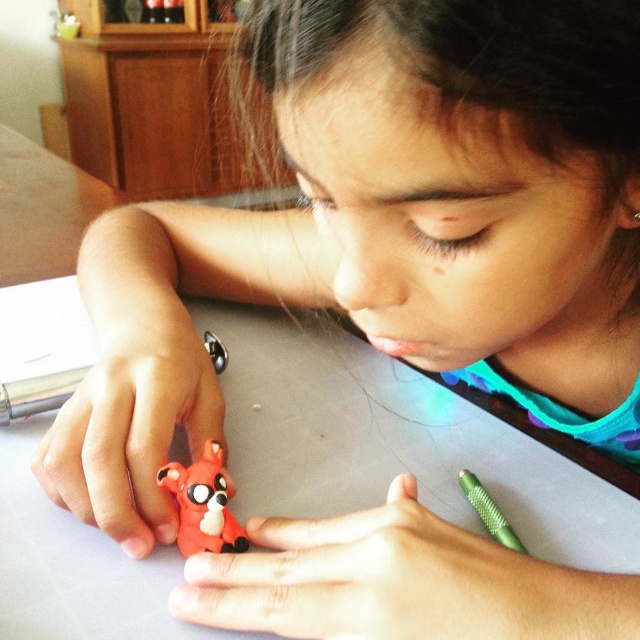
Question: Which point is closer to the camera taking this photo?

Choices:
 (A) (180, 529)
 (B) (500, 538)

Answer: (A)

Question: Can you confirm if rubberized red fox at center is thinner than green metallic pencil at lower right?

Choices:
 (A) yes
 (B) no

Answer: (B)

Question: Does rubberized red fox at center have a lesser width compared to green metallic pencil at lower right?

Choices:
 (A) yes
 (B) no

Answer: (B)

Question: Which point is closer to the camera taking this photo?

Choices:
 (A) (493, 531)
 (B) (192, 483)

Answer: (B)

Question: Does rubberized red fox at center appear on the left side of green metallic pencil at lower right?

Choices:
 (A) yes
 (B) no

Answer: (A)